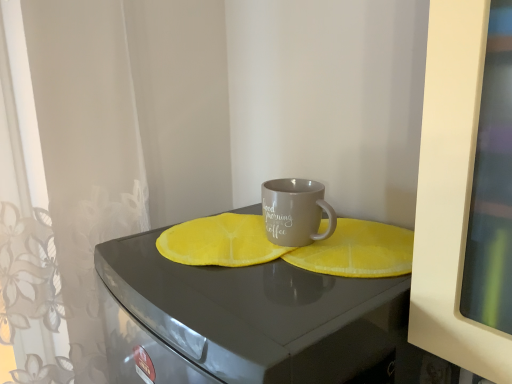
Question: Considering the positions of matte gray table at center and matte gray mug at center in the image, is matte gray table at center bigger or smaller than matte gray mug at center?

Choices:
 (A) big
 (B) small

Answer: (A)

Question: In terms of width, does matte gray table at center look wider or thinner when compared to matte gray mug at center?

Choices:
 (A) wide
 (B) thin

Answer: (A)

Question: Is matte gray table at center in front of or behind matte gray mug at center in the image?

Choices:
 (A) behind
 (B) front

Answer: (B)

Question: From a real-world perspective, relative to matte gray table at center, is matte gray mug at center vertically above or below?

Choices:
 (A) above
 (B) below

Answer: (A)

Question: Looking at the image, does matte gray mug at center seem bigger or smaller compared to matte gray table at center?

Choices:
 (A) big
 (B) small

Answer: (B)

Question: Is matte gray mug at center inside the boundaries of matte gray table at center, or outside?

Choices:
 (A) outside
 (B) inside

Answer: (A)

Question: In the image, is matte gray mug at center on the left side or the right side of matte gray table at center?

Choices:
 (A) left
 (B) right

Answer: (B)